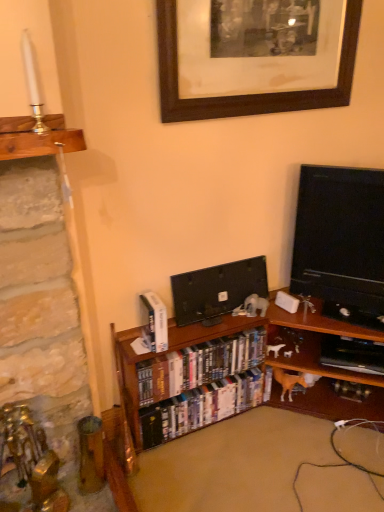
Locate an element on the screen. The height and width of the screenshot is (512, 384). vacant space to the right of hardcover books at center, the third book positioned from the top is located at coordinates (274, 441).